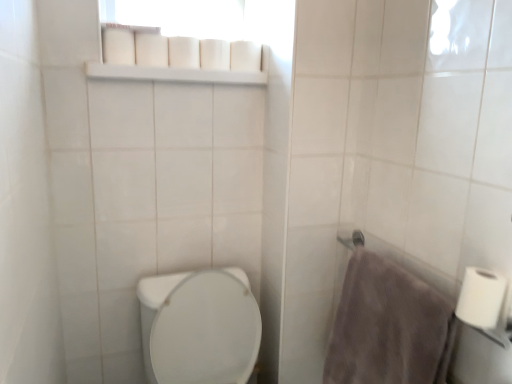
Question: From a real-world perspective, is white matte toilet paper at upper center, marked as the 2th toilet paper in a left-to-right arrangement, below gray fluffy towel at right?

Choices:
 (A) no
 (B) yes

Answer: (A)

Question: Is white matte toilet paper at upper center, acting as the first toilet paper starting from the top, further to camera compared to gray fluffy towel at right?

Choices:
 (A) no
 (B) yes

Answer: (B)

Question: Does white matte toilet paper at upper center, which ranks as the first toilet paper in back-to-front order, turn towards gray fluffy towel at right?

Choices:
 (A) no
 (B) yes

Answer: (A)

Question: Can you confirm if white matte toilet paper at upper center, acting as the first toilet paper starting from the top, is shorter than gray fluffy towel at right?

Choices:
 (A) no
 (B) yes

Answer: (B)

Question: Does white matte toilet paper at upper center, which ranks as the first toilet paper in back-to-front order, appear on the right side of gray fluffy towel at right?

Choices:
 (A) no
 (B) yes

Answer: (A)

Question: From a real-world perspective, is white plastic shelf at upper center physically located above or below gray fluffy towel at right?

Choices:
 (A) above
 (B) below

Answer: (A)

Question: Based on their sizes in the image, would you say white plastic shelf at upper center is bigger or smaller than gray fluffy towel at right?

Choices:
 (A) small
 (B) big

Answer: (A)

Question: Considering the positions of white plastic shelf at upper center and gray fluffy towel at right in the image, is white plastic shelf at upper center taller or shorter than gray fluffy towel at right?

Choices:
 (A) short
 (B) tall

Answer: (A)

Question: Is white plastic shelf at upper center wider or thinner than gray fluffy towel at right?

Choices:
 (A) thin
 (B) wide

Answer: (B)

Question: Is white matte toilet paper at upper center, which appears as the 2th toilet paper when viewed from the right, bigger or smaller than white glossy toilet at lower left?

Choices:
 (A) small
 (B) big

Answer: (A)

Question: In the image, is white matte toilet paper at upper center, the 3th toilet paper when ordered from bottom to top, positioned in front of or behind white glossy toilet at lower left?

Choices:
 (A) front
 (B) behind

Answer: (B)

Question: From the image's perspective, is white matte toilet paper at upper center, which ranks as the first toilet paper in back-to-front order, located above or below white glossy toilet at lower left?

Choices:
 (A) below
 (B) above

Answer: (B)

Question: Considering the positions of point (247, 56) and point (253, 311), is point (247, 56) closer or farther from the camera than point (253, 311)?

Choices:
 (A) farther
 (B) closer

Answer: (A)

Question: In the image, is gray fluffy towel at right positioned in front of or behind white plastic shelf at upper center?

Choices:
 (A) behind
 (B) front

Answer: (B)

Question: Do you think gray fluffy towel at right is within white plastic shelf at upper center, or outside of it?

Choices:
 (A) outside
 (B) inside

Answer: (A)